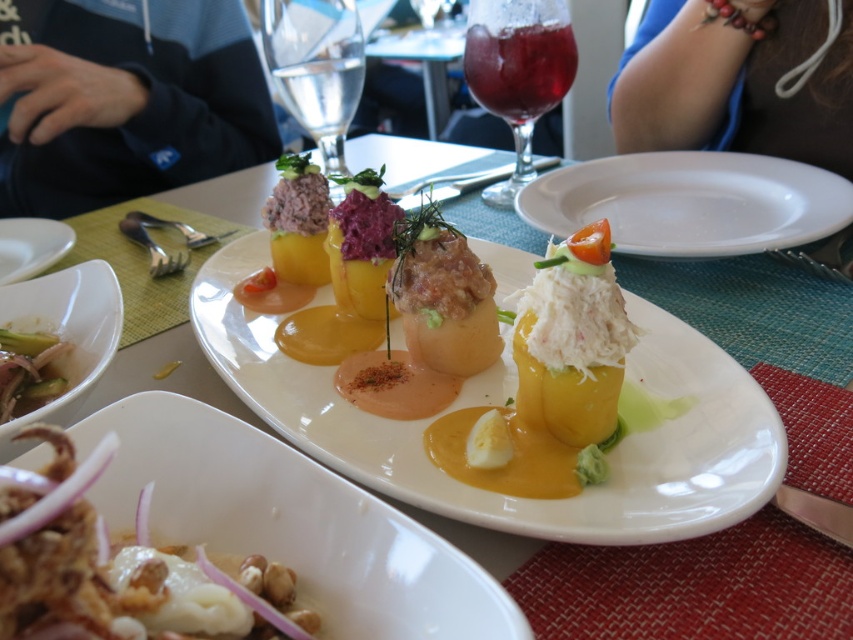
Is transparent glass at upper center thinner than white glossy plate at upper left?

Indeed, transparent glass at upper center has a lesser width compared to white glossy plate at upper left.

Which is behind, point (283, 1) or point (15, 273)?

Point (283, 1)

Who is more forward, (288, 20) or (32, 260)?

Point (32, 260) is in front.

Where is `transparent glass at upper center`? transparent glass at upper center is located at coordinates (316, 67).

Is point (3, 588) closer to viewer compared to point (22, 253)?

Yes.

From the picture: Can you confirm if white creamy sauce at center is bigger than white glossy plate at upper left?

No, white creamy sauce at center is not bigger than white glossy plate at upper left.

Describe the element at coordinates (112, 570) in the screenshot. The image size is (853, 640). I see `white creamy sauce at center` at that location.

Identify the location of white creamy sauce at center. This screenshot has width=853, height=640. (112, 570).

Find the location of a particular element. yellow matte/painted fruit at center is located at coordinates (503, 493).

Does yellow matte/painted fruit at center have a greater width compared to white creamy sauce at center?

Indeed, yellow matte/painted fruit at center has a greater width compared to white creamy sauce at center.

Describe the element at coordinates (503, 493) in the screenshot. Image resolution: width=853 pixels, height=640 pixels. I see `yellow matte/painted fruit at center` at that location.

Locate an element on the screen. This screenshot has width=853, height=640. yellow matte/painted fruit at center is located at coordinates (503, 493).